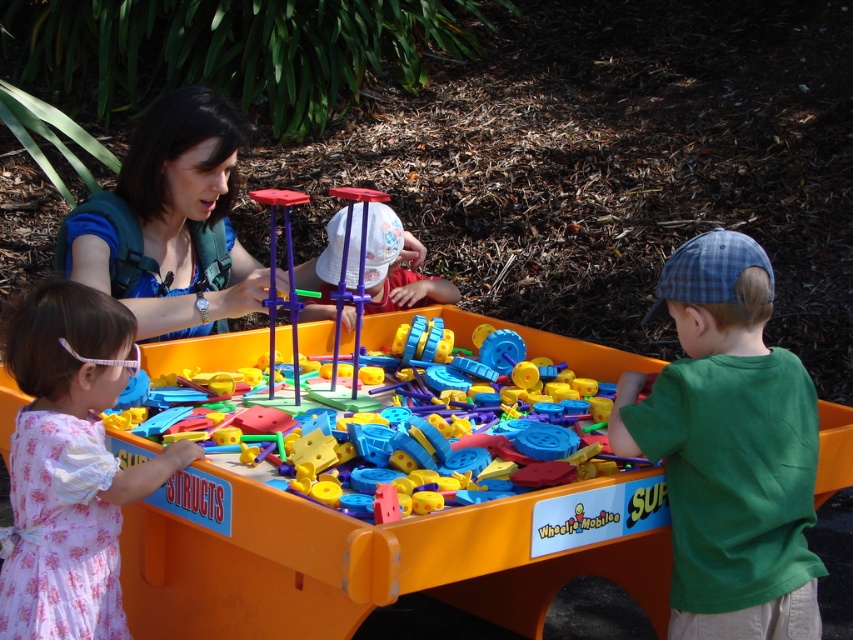
Is green cotton shirt at right to the left of blue fabric backpack at upper left from the viewer's perspective?

No, green cotton shirt at right is not to the left of blue fabric backpack at upper left.

Is point (698, 289) positioned before point (175, 234)?

Yes, point (698, 289) is closer to viewer.

Locate an element on the screen. green cotton shirt at right is located at coordinates (729, 449).

Which is more to the right, pink floral dress at lower left or translucent plastic toy at center?

translucent plastic toy at center is more to the right.

Is pink floral dress at lower left thinner than translucent plastic toy at center?

Correct, pink floral dress at lower left's width is less than translucent plastic toy at center's.

The height and width of the screenshot is (640, 853). In order to click on pink floral dress at lower left in this screenshot , I will do `click(68, 467)`.

How far apart are green cotton shirt at right and translucent plastic toy at center?

green cotton shirt at right and translucent plastic toy at center are 49.82 centimeters apart.

Is point (733, 408) closer to viewer compared to point (318, 416)?

Yes, it is in front of point (318, 416).

At what (x,y) coordinates should I click in order to perform the action: click on green cotton shirt at right. Please return your answer as a coordinate pair (x, y). Image resolution: width=853 pixels, height=640 pixels. Looking at the image, I should click on (729, 449).